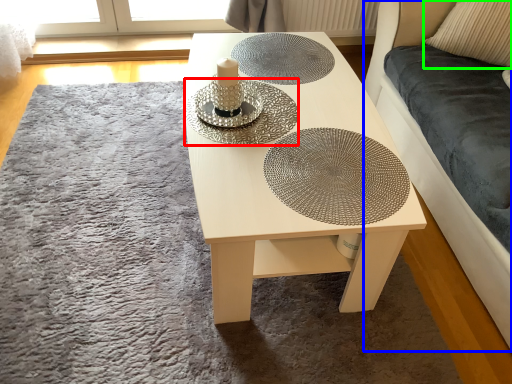
Question: Estimate the real-world distances between objects in this image. Which object is farther from glass plate (highlighted by a red box), couch (highlighted by a blue box) or pillow (highlighted by a green box)?

Choices:
 (A) couch
 (B) pillow

Answer: (B)